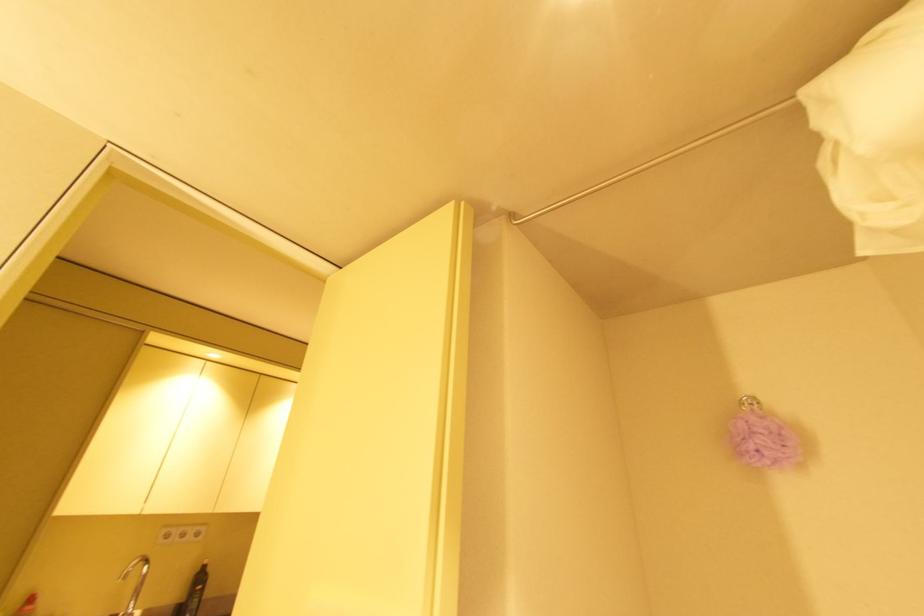
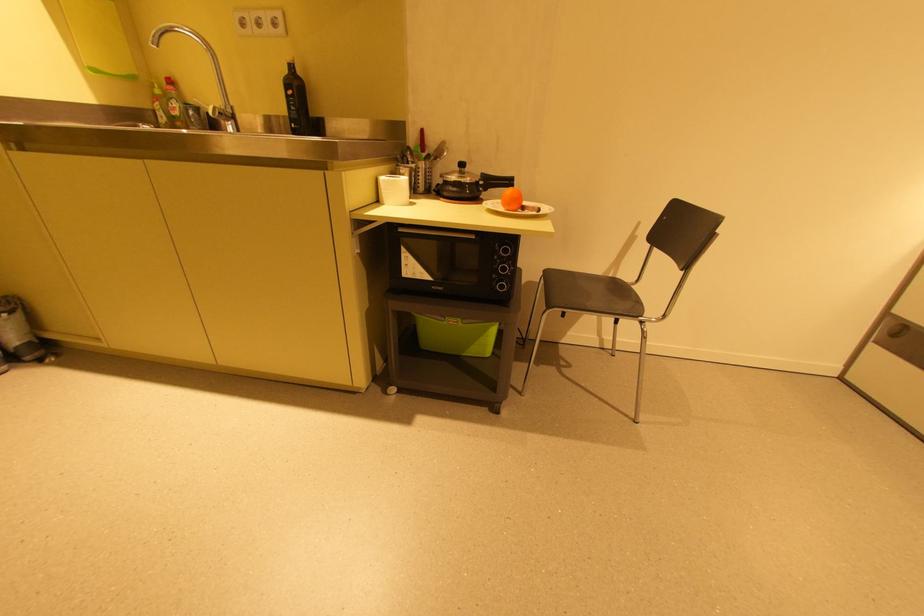
The point at (188, 536) is marked in the first image. Where is the corresponding point in the second image?

(263, 23)